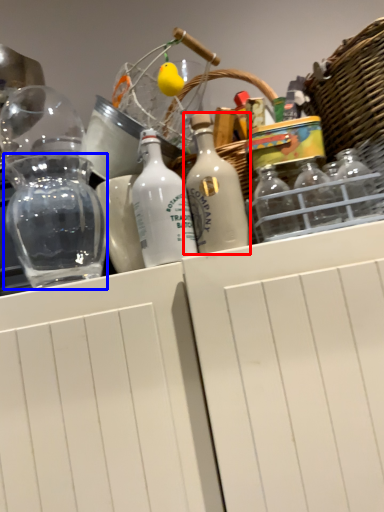
Question: Which of the following is the farthest to the observer, bottle (highlighted by a red box) or glass jar (highlighted by a blue box)?

Choices:
 (A) bottle
 (B) glass jar

Answer: (B)